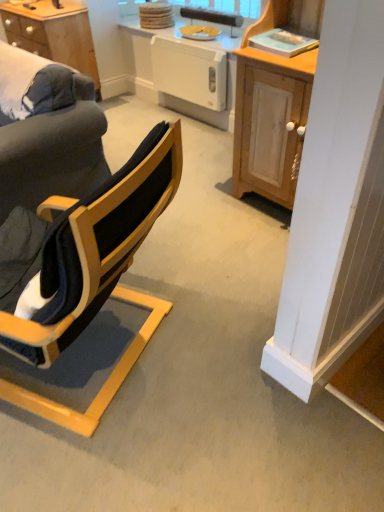
Question: Does matte black chair at left have a greater height compared to white plastic dishwasher at center?

Choices:
 (A) no
 (B) yes

Answer: (B)

Question: Is white plastic dishwasher at center at the back of matte black chair at left?

Choices:
 (A) yes
 (B) no

Answer: (B)

Question: From a real-world perspective, is matte black chair at left located higher than white plastic dishwasher at center?

Choices:
 (A) yes
 (B) no

Answer: (A)

Question: Is matte black chair at left bigger than white plastic dishwasher at center?

Choices:
 (A) yes
 (B) no

Answer: (A)

Question: From the image's perspective, is matte black chair at left located above white plastic dishwasher at center?

Choices:
 (A) yes
 (B) no

Answer: (B)

Question: From the image's perspective, would you say matte black chair at left is shown under white plastic dishwasher at center?

Choices:
 (A) yes
 (B) no

Answer: (A)

Question: Considering the relative sizes of white plastic dishwasher at center and matte black chair at left in the image provided, is white plastic dishwasher at center thinner than matte black chair at left?

Choices:
 (A) no
 (B) yes

Answer: (B)

Question: Is white plastic dishwasher at center at the left side of matte black chair at left?

Choices:
 (A) no
 (B) yes

Answer: (A)

Question: Does white plastic dishwasher at center have a lesser height compared to matte black chair at left?

Choices:
 (A) yes
 (B) no

Answer: (A)

Question: From the image's perspective, does white plastic dishwasher at center appear higher than matte black chair at left?

Choices:
 (A) no
 (B) yes

Answer: (B)

Question: Is white plastic dishwasher at center next to matte black chair at left?

Choices:
 (A) yes
 (B) no

Answer: (B)

Question: Does white plastic dishwasher at center lie behind matte black chair at left?

Choices:
 (A) no
 (B) yes

Answer: (B)

Question: From the image's perspective, is wooden desk at upper left on top of white glossy radiator at center?

Choices:
 (A) yes
 (B) no

Answer: (A)